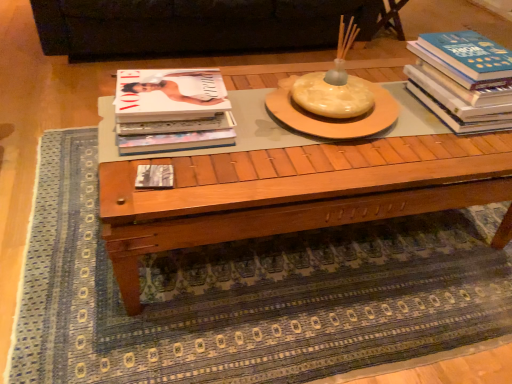
Locate an element on the screen. The width and height of the screenshot is (512, 384). wooden coffee table at center is located at coordinates (293, 193).

At what (x,y) coordinates should I click in order to perform the action: click on wooden coffee table at center. Please return your answer as a coordinate pair (x, y). Looking at the image, I should click on (293, 193).

Does black leather couch at upper center have a greater width compared to wooden coffee table at center?

Indeed, black leather couch at upper center has a greater width compared to wooden coffee table at center.

Where is `couch that is under the wooden coffee table at center (from a real-world perspective)`? Image resolution: width=512 pixels, height=384 pixels. couch that is under the wooden coffee table at center (from a real-world perspective) is located at coordinates (201, 26).

Based on the photo, from a real-world perspective, who is located higher, black leather couch at upper center or wooden coffee table at center?

wooden coffee table at center, from a real-world perspective.

How much distance is there between black leather couch at upper center and wooden coffee table at center?

black leather couch at upper center is 1.40 meters away from wooden coffee table at center.

Is matte white magazine at left, which is the 2th book in left-to-right order, to the left of wooden coffee table at center from the viewer's perspective?

Indeed, matte white magazine at left, which is the 2th book in left-to-right order, is positioned on the left side of wooden coffee table at center.

Is point (161, 108) less distant than point (101, 108)?

Yes, point (161, 108) is closer to viewer.

Considering the positions of objects matte white magazine at left, which is the 2th book in left-to-right order, and wooden coffee table at center in the image provided, who is behind, matte white magazine at left, which is the 2th book in left-to-right order, or wooden coffee table at center?

Positioned behind is matte white magazine at left, which is the 2th book in left-to-right order.

Which of these two, matte white magazine at left, which is the 2th book in left-to-right order, or wooden coffee table at center, is wider?

Wider between the two is wooden coffee table at center.

From the image's perspective, which is below, matte white magazine at left, which appears as the 2th book when viewed from the right, or blue hardcover book at right, which ranks as the third book in left-to-right order?

matte white magazine at left, which appears as the 2th book when viewed from the right, from the image's perspective.

From a real-world perspective, is matte white magazine at left, which is the 2th book in left-to-right order, located higher than blue hardcover book at right, which ranks as the third book in left-to-right order?

Incorrect, from a real-world perspective, matte white magazine at left, which is the 2th book in left-to-right order, is lower than blue hardcover book at right, which ranks as the third book in left-to-right order.

In the scene shown: Which is in front, matte white magazine at left, which appears as the 2th book when viewed from the right, or blue hardcover book at right, which ranks as the third book in left-to-right order?

matte white magazine at left, which appears as the 2th book when viewed from the right.

Is matte white magazine at left, which appears as the 2th book when viewed from the right, far from blue hardcover book at right, which appears as the first book when viewed from the right?

Actually, matte white magazine at left, which appears as the 2th book when viewed from the right, and blue hardcover book at right, which appears as the first book when viewed from the right, are a little close together.

Looking at this image, which of these two, black leather couch at upper center or blue hardcover book at right, which ranks as the third book in left-to-right order, is smaller?

blue hardcover book at right, which ranks as the third book in left-to-right order, is smaller.

Is point (152, 49) more distant than point (487, 116)?

Yes, point (152, 49) is behind point (487, 116).

From the image's perspective, is black leather couch at upper center located above blue hardcover book at right, which ranks as the third book in left-to-right order?

Yes.

Considering the sizes of black leather couch at upper center and blue hardcover book at right, which appears as the first book when viewed from the right, in the image, is black leather couch at upper center wider or thinner than blue hardcover book at right, which appears as the first book when viewed from the right,?

Considering their sizes, black leather couch at upper center looks broader than blue hardcover book at right, which appears as the first book when viewed from the right.

How much distance is there between wooden coffee table at center and matte black book at center, arranged as the first book when viewed from the left?

wooden coffee table at center and matte black book at center, arranged as the first book when viewed from the left, are 15.34 inches apart from each other.

Would you say wooden coffee table at center contains matte black book at center, marked as the third book in a right-to-left arrangement?

Yes, wooden coffee table at center is surrounding matte black book at center, marked as the third book in a right-to-left arrangement.

Is wooden coffee table at center facing away from matte black book at center, marked as the third book in a right-to-left arrangement?

wooden coffee table at center does not have its back to matte black book at center, marked as the third book in a right-to-left arrangement.

Can you see wooden coffee table at center touching matte black book at center, arranged as the first book when viewed from the left?

They are not placed beside each other.

Between matte white magazine at left, which appears as the 2th book when viewed from the right, and matte black book at center, arranged as the first book when viewed from the left, which one has larger width?

matte white magazine at left, which appears as the 2th book when viewed from the right.

Between matte white magazine at left, which appears as the 2th book when viewed from the right, and matte black book at center, marked as the third book in a right-to-left arrangement, which one has less height?

Standing shorter between the two is matte black book at center, marked as the third book in a right-to-left arrangement.

Is matte white magazine at left, which is the 2th book in left-to-right order, behind matte black book at center, arranged as the first book when viewed from the left?

Yes, the depth of matte white magazine at left, which is the 2th book in left-to-right order, is greater than that of matte black book at center, arranged as the first book when viewed from the left.

Consider the image. Looking at the image, does matte white magazine at left, which is the 2th book in left-to-right order, seem bigger or smaller compared to matte black book at center, arranged as the first book when viewed from the left?

Considering their sizes, matte white magazine at left, which is the 2th book in left-to-right order, takes up more space than matte black book at center, arranged as the first book when viewed from the left.

Would you say black leather couch at upper center is to the left or to the right of matte white magazine at left, which appears as the 2th book when viewed from the right, in the picture?

Based on their positions, black leather couch at upper center is located to the left of matte white magazine at left, which appears as the 2th book when viewed from the right.

Considering the relative sizes of black leather couch at upper center and matte white magazine at left, which appears as the 2th book when viewed from the right, in the image provided, is black leather couch at upper center bigger than matte white magazine at left, which appears as the 2th book when viewed from the right,?

Yes.

Considering the relative sizes of black leather couch at upper center and matte white magazine at left, which is the 2th book in left-to-right order, in the image provided, is black leather couch at upper center wider than matte white magazine at left, which is the 2th book in left-to-right order,?

Indeed, black leather couch at upper center has a greater width compared to matte white magazine at left, which is the 2th book in left-to-right order.

Locate an element on the screen. The height and width of the screenshot is (384, 512). coffee table in front of the black leather couch at upper center is located at coordinates (293, 193).

What are the coordinates of `coffee table on the right of the matte white magazine at left, which appears as the 2th book when viewed from the right` in the screenshot? It's located at 293,193.

Looking at the image, which one is located further to wooden coffee table at center, matte white magazine at left, which appears as the 2th book when viewed from the right, or blue hardcover book at right, which appears as the first book when viewed from the right?

blue hardcover book at right, which appears as the first book when viewed from the right, is positioned further to the anchor wooden coffee table at center.

Considering their positions, is wooden coffee table at center positioned closer to blue hardcover book at right, which appears as the first book when viewed from the right, than matte white magazine at left, which is the 2th book in left-to-right order?

Based on the image, wooden coffee table at center appears to be nearer to blue hardcover book at right, which appears as the first book when viewed from the right.

Considering their positions, is wooden coffee table at center positioned closer to black leather couch at upper center than matte black book at center, marked as the third book in a right-to-left arrangement?

The object closer to black leather couch at upper center is wooden coffee table at center.

When comparing their distances from matte white magazine at left, which is the 2th book in left-to-right order, does blue hardcover book at right, which appears as the first book when viewed from the right, or black leather couch at upper center seem further?

Among the two, black leather couch at upper center is located further to matte white magazine at left, which is the 2th book in left-to-right order.

From the image, which object appears to be farther from blue hardcover book at right, which ranks as the third book in left-to-right order, matte black book at center, arranged as the first book when viewed from the left, or wooden coffee table at center?

Among the two, matte black book at center, arranged as the first book when viewed from the left, is located further to blue hardcover book at right, which ranks as the third book in left-to-right order.

Consider the image. Which object lies nearer to the anchor point matte black book at center, marked as the third book in a right-to-left arrangement, blue hardcover book at right, which appears as the first book when viewed from the right, or wooden coffee table at center?

wooden coffee table at center.

From the image, which object appears to be nearer to matte white magazine at left, which appears as the 2th book when viewed from the right, black leather couch at upper center or blue hardcover book at right, which appears as the first book when viewed from the right?

Among the two, blue hardcover book at right, which appears as the first book when viewed from the right, is located nearer to matte white magazine at left, which appears as the 2th book when viewed from the right.

Based on their spatial positions, is wooden coffee table at center or matte white magazine at left, which is the 2th book in left-to-right order, closer to matte black book at center, marked as the third book in a right-to-left arrangement?

Among the two, matte white magazine at left, which is the 2th book in left-to-right order, is located nearer to matte black book at center, marked as the third book in a right-to-left arrangement.

Identify the location of coffee table between matte black book at center, marked as the third book in a right-to-left arrangement, and blue hardcover book at right, which ranks as the third book in left-to-right order, from left to right. (293, 193).

This screenshot has width=512, height=384. I want to click on coffee table between black leather couch at upper center and matte black book at center, marked as the third book in a right-to-left arrangement, from top to bottom, so click(x=293, y=193).

You are a GUI agent. You are given a task and a screenshot of the screen. Output one action in this format:
    pyautogui.click(x=<x>, y=<y>)
    Task: Click on the coffee table between matte white magazine at left, which is the 2th book in left-to-right order, and blue hardcover book at right, which appears as the first book when viewed from the right
    
    Given the screenshot: What is the action you would take?
    pyautogui.click(x=293, y=193)

The image size is (512, 384). What are the coordinates of `book between matte black book at center, arranged as the first book when viewed from the left, and wooden coffee table at center` in the screenshot? It's located at (169, 95).